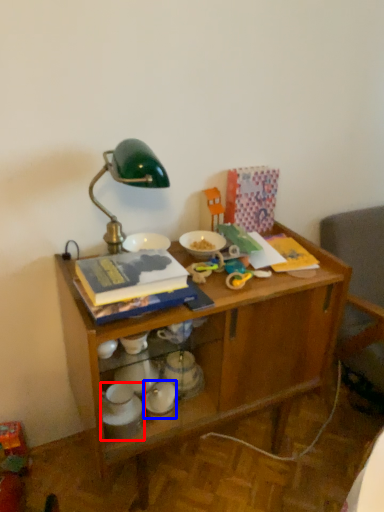
Question: Which object is closer to the camera taking this photo, tableware (highlighted by a red box) or tableware (highlighted by a blue box)?

Choices:
 (A) tableware
 (B) tableware

Answer: (A)